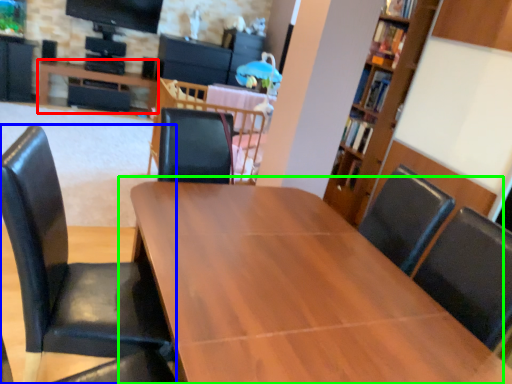
Question: Based on their relative distances, which object is nearer to table (highlighted by a red box)? Choose from chair (highlighted by a blue box) and table (highlighted by a green box).

Choices:
 (A) chair
 (B) table

Answer: (B)